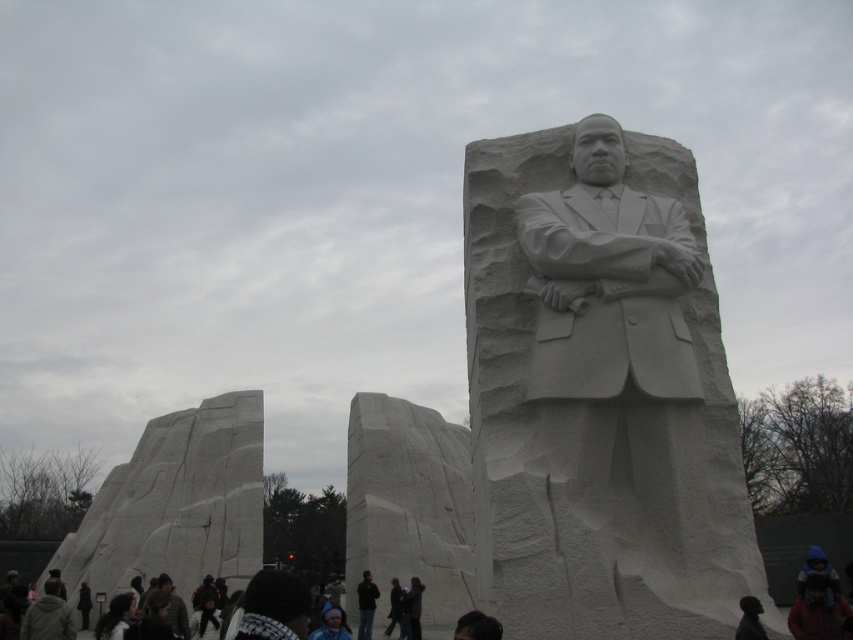
You are an artist analyzing the statue of Martin Luther King Jr. You notice two elements on the statue. The first is the black matte jacket at center and the second is the dark clothing at lower center. Which of these two elements is shorter in height?

The black matte jacket at center has a lesser height compared to the dark clothing at lower center, so the black matte jacket at center is shorter in height.

Consider the image. You are a tour guide explaining the statue of Martin Luther King Jr. to visitors. You mention both the black matte jacket at center and the dark clothing at lower center. Which one is positioned to the right of the other?

The black matte jacket at center is to the right of dark clothing at lower center.

You are a visitor at the memorial and want to take a photo that shows both the white marble statue at center and the dark clothing at lower center. Based on their sizes, which object should you focus on first to ensure both are in frame?

The white marble statue at center has a smaller size compared to the dark clothing at lower center, so you should focus on the dark clothing at lower center first to ensure both are in frame.